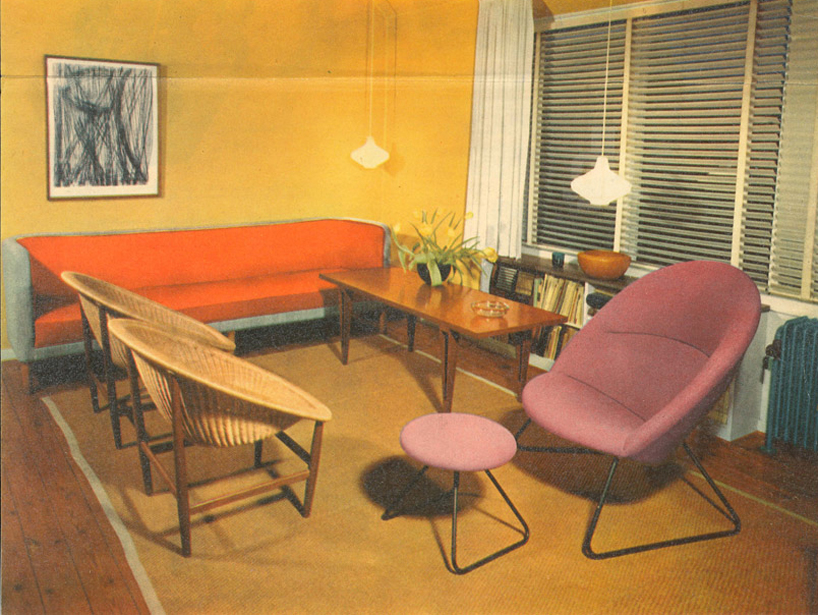
You are a GUI agent. You are given a task and a screenshot of the screen. Output one action in this format:
    pyautogui.click(x=<x>, y=<y>)
    Task: Click on the floor rug
    The height and width of the screenshot is (615, 818).
    Given the screenshot: What is the action you would take?
    pyautogui.click(x=327, y=550)